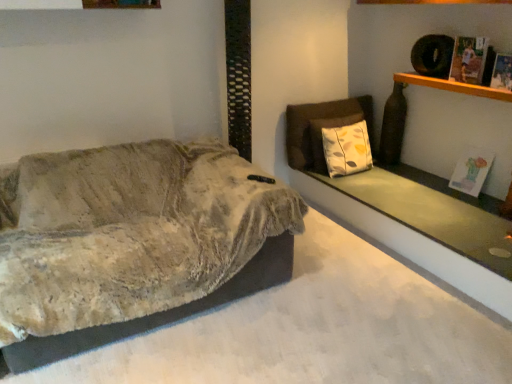
Identify the location of free point below wooden shelf at upper right (from a real-world perspective). The image size is (512, 384). (455, 190).